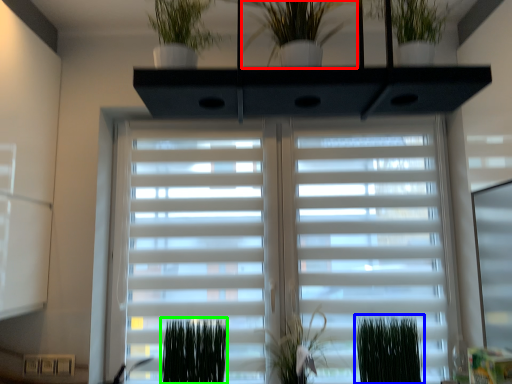
Question: Estimate the real-world distances between objects in this image. Which object is farther from houseplant (highlighted by a red box), plant (highlighted by a blue box) or plant (highlighted by a green box)?

Choices:
 (A) plant
 (B) plant

Answer: (A)